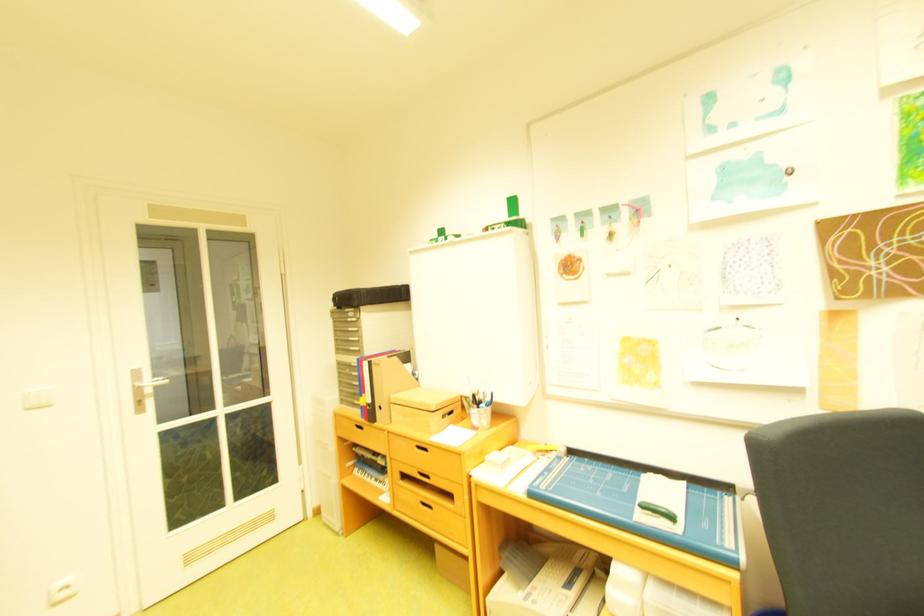
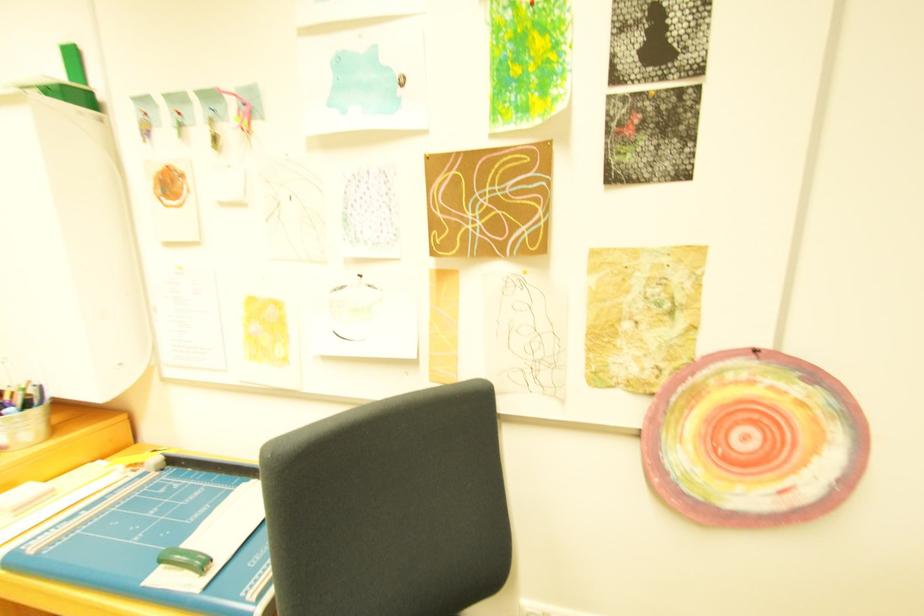
Question: Based on the continuous images, in which direction is the camera rotating? Reply with the corresponding letter.

Choices:
 (A) Left
 (B) Right
 (C) Up
 (D) Down

Answer: (B)